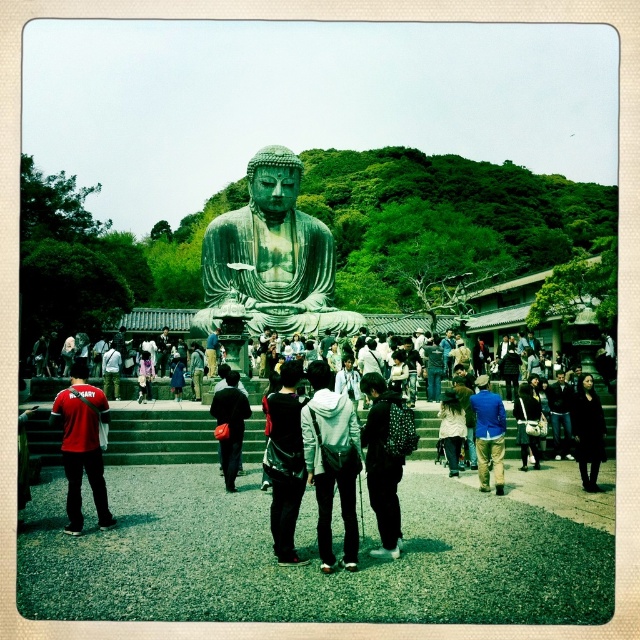
You are a photographer trying to capture a clear shot of the Buddha statue. There are two people in the foreground wearing a white hoodie at center and a matte black jacket at center. Which person might you ask to move so that the statue is fully visible?

The white hoodie at center is much taller than the matte black jacket at center, so asking the person wearing the white hoodie at center to move would allow for a clearer view of the statue.

You are a photographer trying to capture a clear shot of the Buddha statue. You notice two people in the foreground wearing a black dotted hoodie at center and a blue cotton shirt at center. Which clothing item would block your view more if they stand between you and the statue?

The black dotted hoodie at center has a larger size compared to the blue cotton shirt at center, so it would block your view more if they stand between you and the statue.